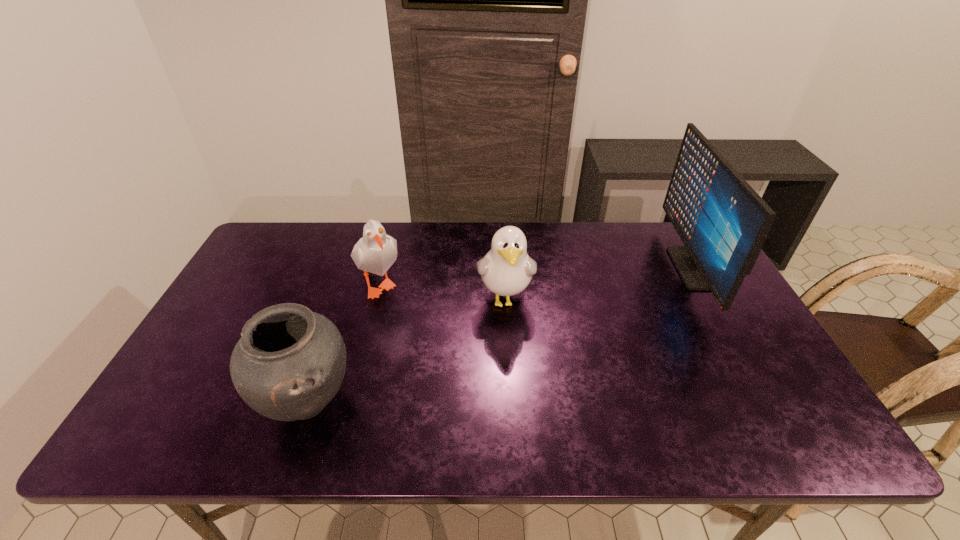
In order to click on empty location between the left gull and the computer monitor in this screenshot , I will do `click(537, 275)`.

Where is `vacant point located between the nearest object and the second object from right to left`? vacant point located between the nearest object and the second object from right to left is located at coordinates (407, 351).

What are the coordinates of `free space between the rightmost object and the nearest object` in the screenshot? It's located at (501, 335).

Where is `unoccupied area between the nearest object and the tallest object`? Image resolution: width=960 pixels, height=540 pixels. unoccupied area between the nearest object and the tallest object is located at coordinates (501, 335).

The width and height of the screenshot is (960, 540). Find the location of `free space that is in between the tallest object and the nearest object`. free space that is in between the tallest object and the nearest object is located at coordinates (501, 335).

This screenshot has width=960, height=540. What are the coordinates of `free space between the third object from left to right and the left gull` in the screenshot? It's located at (443, 291).

The height and width of the screenshot is (540, 960). What are the coordinates of `free space between the left gull and the rightmost object` in the screenshot? It's located at (537, 275).

Identify the location of vacant space that's between the tallest object and the second object from right to left. (599, 284).

I want to click on free space between the tallest object and the nearest object, so click(501, 335).

The height and width of the screenshot is (540, 960). What are the coordinates of `free space between the rightmost object and the nearest object` in the screenshot? It's located at (501, 335).